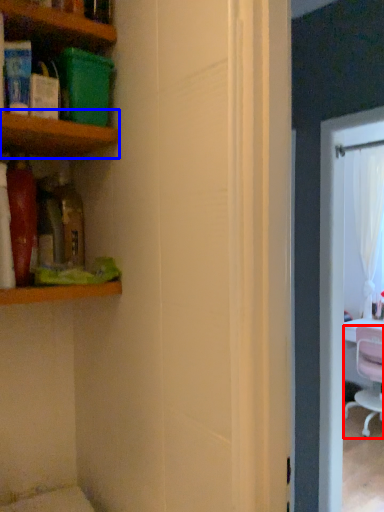
Question: Which object is closer to the camera taking this photo, chair (highlighted by a red box) or shelf (highlighted by a blue box)?

Choices:
 (A) chair
 (B) shelf

Answer: (B)